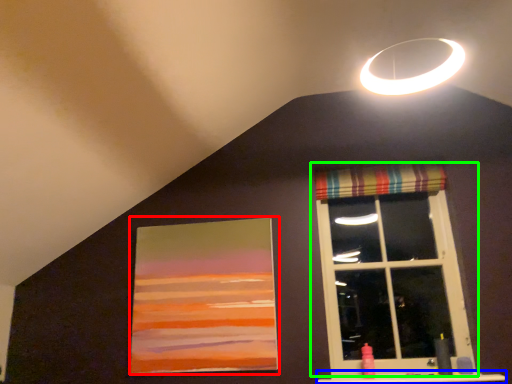
Question: Considering the real-world distances, which object is closest to picture frame (highlighted by a red box)? window sill (highlighted by a blue box) or window (highlighted by a green box).

Choices:
 (A) window sill
 (B) window

Answer: (B)